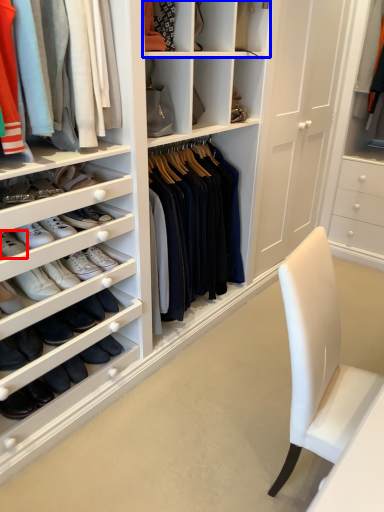
Question: Which of the following is the closest to the observer, footwear (highlighted by a red box) or shelf (highlighted by a blue box)?

Choices:
 (A) footwear
 (B) shelf

Answer: (A)